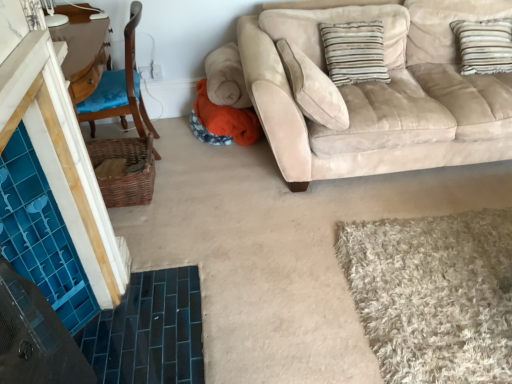
Question: Do you think striped fabric pillow at upper right is within suede beige couch at upper right, or outside of it?

Choices:
 (A) inside
 (B) outside

Answer: (A)

Question: Considering the positions of striped fabric pillow at upper right and suede beige couch at upper right in the image, is striped fabric pillow at upper right taller or shorter than suede beige couch at upper right?

Choices:
 (A) short
 (B) tall

Answer: (A)

Question: Which object is positioned closest to the blue fabric chair at left?

Choices:
 (A) striped fabric pillow at upper right
 (B) beige shaggy rug at lower right
 (C) woven brown basket at left
 (D) suede beige couch at upper right

Answer: (C)

Question: Which object is positioned closest to the suede beige couch at upper right?

Choices:
 (A) beige shaggy rug at lower right
 (B) striped fabric pillow at upper right
 (C) blue fabric chair at left
 (D) woven brown basket at left

Answer: (B)